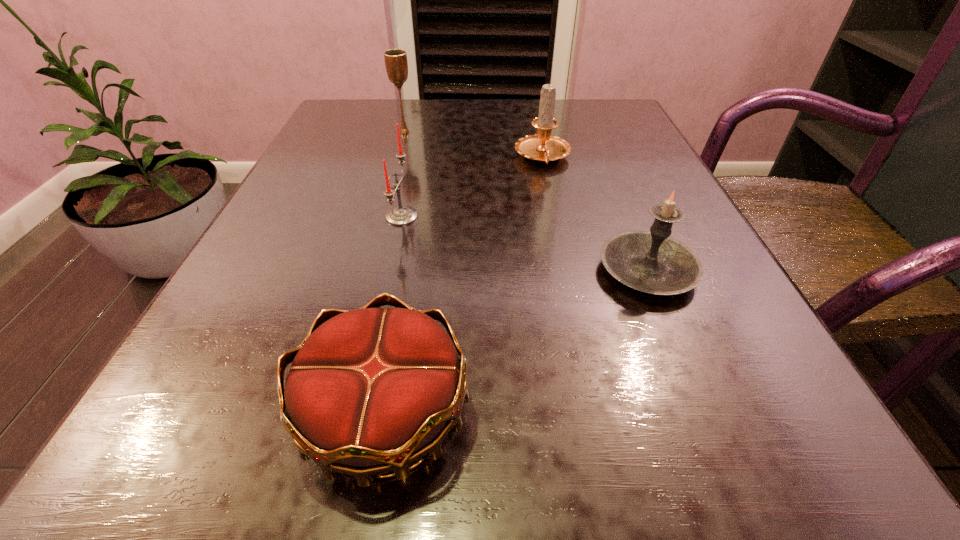
Where is `candle that can be found as the closest to the farthest candle`? This screenshot has width=960, height=540. candle that can be found as the closest to the farthest candle is located at coordinates (401, 215).

The width and height of the screenshot is (960, 540). What are the coordinates of `vacant region that satisfies the following two spatial constraints: 1. on the front side of the chalice; 2. on the right side of the second farthest object` in the screenshot? It's located at (397, 158).